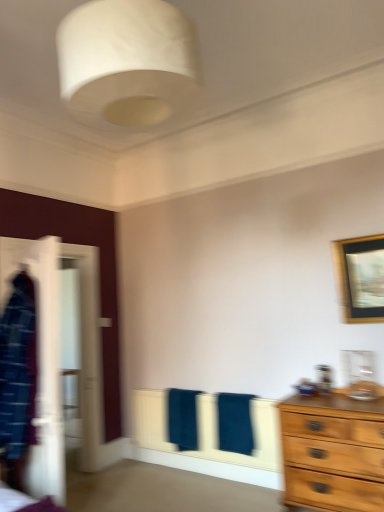
Question: From the image's perspective, is dark blue towel at center, which appears as the 1th bath towel when viewed from the right, under wooden framed picture at upper right?

Choices:
 (A) yes
 (B) no

Answer: (A)

Question: Does dark blue towel at center, which appears as the 1th bath towel when viewed from the right, have a lesser height compared to wooden framed picture at upper right?

Choices:
 (A) no
 (B) yes

Answer: (B)

Question: Is dark blue towel at center, which appears as the 1th bath towel when viewed from the right, surrounding wooden framed picture at upper right?

Choices:
 (A) no
 (B) yes

Answer: (A)

Question: Can you confirm if dark blue towel at center, which appears as the 1th bath towel when viewed from the right, is positioned to the right of wooden framed picture at upper right?

Choices:
 (A) yes
 (B) no

Answer: (B)

Question: Is dark blue towel at center, which appears as the 1th bath towel when viewed from the right, completely or partially outside of wooden framed picture at upper right?

Choices:
 (A) yes
 (B) no

Answer: (A)

Question: Is white glossy wardrobe at left in front of or behind dark blue towel at center, the 2th bath towel in the left-to-right sequence, in the image?

Choices:
 (A) behind
 (B) front

Answer: (B)

Question: Considering the relative positions of white glossy wardrobe at left and dark blue towel at center, the 2th bath towel in the left-to-right sequence, in the image provided, is white glossy wardrobe at left to the left or to the right of dark blue towel at center, the 2th bath towel in the left-to-right sequence,?

Choices:
 (A) right
 (B) left

Answer: (B)

Question: Is white glossy wardrobe at left wider or thinner than dark blue towel at center, the 2th bath towel in the left-to-right sequence?

Choices:
 (A) thin
 (B) wide

Answer: (A)

Question: Is point (64, 480) positioned closer to the camera than point (218, 394)?

Choices:
 (A) farther
 (B) closer

Answer: (B)

Question: Considering the positions of point (46, 345) and point (91, 32), is point (46, 345) closer or farther from the camera than point (91, 32)?

Choices:
 (A) closer
 (B) farther

Answer: (B)

Question: Is white glossy wardrobe at left situated inside white fabric lampshade at upper center or outside?

Choices:
 (A) inside
 (B) outside

Answer: (B)

Question: Is white glossy wardrobe at left wider or thinner than white fabric lampshade at upper center?

Choices:
 (A) thin
 (B) wide

Answer: (A)

Question: Is white glossy wardrobe at left to the left or to the right of white fabric lampshade at upper center in the image?

Choices:
 (A) left
 (B) right

Answer: (A)

Question: Is dark blue towel at center, marked as the second bath towel in a right-to-left arrangement, in front of or behind dark blue towel at center, which appears as the 1th bath towel when viewed from the right, in the image?

Choices:
 (A) behind
 (B) front

Answer: (A)

Question: Is dark blue towel at center, marked as the second bath towel in a right-to-left arrangement, wider or thinner than dark blue towel at center, which appears as the 1th bath towel when viewed from the right?

Choices:
 (A) thin
 (B) wide

Answer: (A)